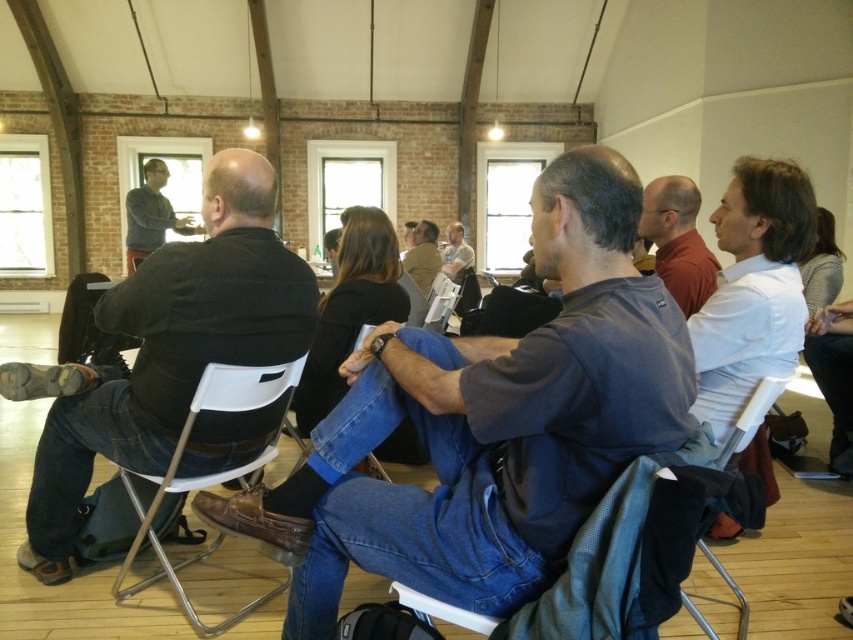
What do you see at coordinates (151, 214) in the screenshot? I see `gray sweater at upper left` at bounding box center [151, 214].

Can you confirm if gray sweater at upper left is positioned to the right of white plastic chair at center?

Incorrect, gray sweater at upper left is not on the right side of white plastic chair at center.

Between point (137, 188) and point (691, 605), which one is positioned behind?

The point (137, 188) is more distant.

This screenshot has width=853, height=640. Find the location of `gray sweater at upper left`. gray sweater at upper left is located at coordinates (151, 214).

Is point (184, 598) in front of point (787, 381)?

No, it is not.

Is white plastic chair at lower left positioned behind white plastic chair at center?

Yes.

Is point (143, 512) positioned after point (775, 387)?

Yes, it is.

Locate an element on the screen. The width and height of the screenshot is (853, 640). white plastic chair at lower left is located at coordinates (209, 474).

Who is taller, black leather jacket at left or matte brown shirt at center?

With more height is black leather jacket at left.

Is point (213, 276) farther from camera compared to point (418, 268)?

No.

Find the location of a particular element. This screenshot has width=853, height=640. black leather jacket at left is located at coordinates [166, 349].